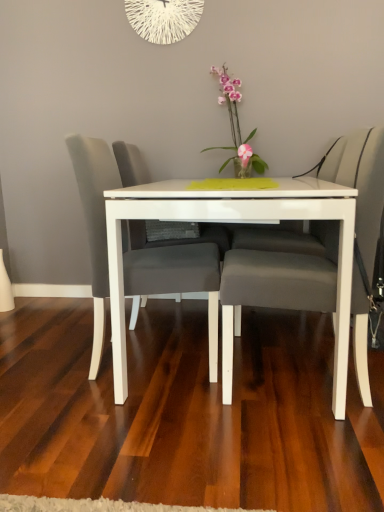
I want to click on matte gray chair at center, the first chair positioned from the left, so click(x=176, y=278).

The height and width of the screenshot is (512, 384). I want to click on matte gray swivel chair at center, so click(178, 239).

Describe the element at coordinates (236, 126) in the screenshot. I see `pink glossy orchid at center` at that location.

Identify the location of pink glossy orchid at center. (236, 126).

This screenshot has height=512, width=384. Describe the element at coordinates (234, 222) in the screenshot. I see `white glossy table at center` at that location.

Find the location of a particular element. This screenshot has height=512, width=384. matte gray chair at center, the first chair positioned from the left is located at coordinates (176, 278).

Does matte gray cushioned chair at center, the 1th chair from the right, have a larger size compared to white glossy table at center?

No.

Considering the relative positions of matte gray cushioned chair at center, the 1th chair from the right, and white glossy table at center in the image provided, is matte gray cushioned chair at center, the 1th chair from the right, to the left or to the right of white glossy table at center?

matte gray cushioned chair at center, the 1th chair from the right, is to the right of white glossy table at center.

Is point (339, 147) less distant than point (343, 400)?

No, (339, 147) is further to viewer.

Who is bigger, matte gray swivel chair at center or white string clock at upper center?

matte gray swivel chair at center.

Locate an element on the screen. oval that appears above the matte gray swivel chair at center (from the image's perspective) is located at coordinates (163, 18).

Which object is closer to the camera taking this photo, matte gray swivel chair at center or white string clock at upper center?

matte gray swivel chair at center is in front.

In the scene shown: Is white glossy table at center in front of matte gray swivel chair at center?

Yes.

At what (x,y) coordinates should I click in order to perform the action: click on swivel chair on the left of white glossy table at center. Please return your answer as a coordinate pair (x, y). Looking at the image, I should click on (178, 239).

Is white glossy table at center looking in the opposite direction of matte gray swivel chair at center?

white glossy table at center is not turned away from matte gray swivel chair at center.

Is matte gray chair at center, the first chair positioned from the left, located outside pink glossy orchid at center?

Yes, matte gray chair at center, the first chair positioned from the left, is not within pink glossy orchid at center.

Does matte gray chair at center, arranged as the 2th chair when viewed from the right, come behind pink glossy orchid at center?

No, matte gray chair at center, arranged as the 2th chair when viewed from the right, is in front of pink glossy orchid at center.

From the image's perspective, is matte gray chair at center, the first chair positioned from the left, positioned above or below pink glossy orchid at center?

matte gray chair at center, the first chair positioned from the left, is below pink glossy orchid at center.

Based on the photo, does white string clock at upper center have a lesser width compared to matte gray chair at center, the first chair positioned from the left?

Correct, the width of white string clock at upper center is less than that of matte gray chair at center, the first chair positioned from the left.

Can you confirm if white string clock at upper center is positioned to the right of matte gray chair at center, arranged as the 2th chair when viewed from the right?

Correct, you'll find white string clock at upper center to the right of matte gray chair at center, arranged as the 2th chair when viewed from the right.

Considering the relative sizes of pink glossy orchid at center and white string clock at upper center in the image provided, is pink glossy orchid at center thinner than white string clock at upper center?

Incorrect, the width of pink glossy orchid at center is not less than that of white string clock at upper center.

Who is taller, pink glossy orchid at center or white string clock at upper center?

pink glossy orchid at center.

Is pink glossy orchid at center positioned beyond the bounds of white string clock at upper center?

Indeed, pink glossy orchid at center is completely outside white string clock at upper center.

Considering the sizes of pink glossy orchid at center and white string clock at upper center in the image, is pink glossy orchid at center bigger or smaller than white string clock at upper center?

→ Considering their sizes, pink glossy orchid at center takes up more space than white string clock at upper center.

Does white string clock at upper center have a greater width compared to matte gray swivel chair at center?

No, white string clock at upper center is not wider than matte gray swivel chair at center.

What's the angular difference between white string clock at upper center and matte gray swivel chair at center's facing directions?

The angle between the facing direction of white string clock at upper center and the facing direction of matte gray swivel chair at center is 90 degrees.

Based on the photo, from the image's perspective, which is below, white string clock at upper center or matte gray swivel chair at center?

matte gray swivel chair at center.

The image size is (384, 512). What are the coordinates of `chair that is the 1st object above the white glossy table at center (from a real-world perspective)` in the screenshot? It's located at (276, 278).

You are a GUI agent. You are given a task and a screenshot of the screen. Output one action in this format:
    pyautogui.click(x=<x>, y=<y>)
    Task: Click on the swivel chair located on the right of white string clock at upper center
    This screenshot has height=512, width=384.
    Given the screenshot: What is the action you would take?
    pyautogui.click(x=178, y=239)

Which object lies nearer to the anchor point matte gray cushioned chair at center, the 1th chair from the right, white glossy table at center or matte gray chair at center, arranged as the 2th chair when viewed from the right?

white glossy table at center lies closer to matte gray cushioned chair at center, the 1th chair from the right, than the other object.

Which object lies further to the anchor point pink glossy orchid at center, white string clock at upper center or matte gray cushioned chair at center, which is counted as the 2th chair, starting from the left?

Based on the image, matte gray cushioned chair at center, which is counted as the 2th chair, starting from the left, appears to be further to pink glossy orchid at center.

From the picture: Considering their positions, is matte gray swivel chair at center positioned further to white string clock at upper center than pink glossy orchid at center?

Based on the image, matte gray swivel chair at center appears to be further to white string clock at upper center.

Looking at the image, which one is located closer to matte gray swivel chair at center, matte gray chair at center, arranged as the 2th chair when viewed from the right, or pink glossy orchid at center?

matte gray chair at center, arranged as the 2th chair when viewed from the right, is positioned closer to the anchor matte gray swivel chair at center.

From the image, which object appears to be farther from white string clock at upper center, matte gray chair at center, arranged as the 2th chair when viewed from the right, or white glossy table at center?

white glossy table at center is positioned further to the anchor white string clock at upper center.

Estimate the real-world distances between objects in this image. Which object is closer to white glossy table at center, white string clock at upper center or pink glossy orchid at center?

The object closer to white glossy table at center is pink glossy orchid at center.

Which object lies further to the anchor point matte gray cushioned chair at center, the 1th chair from the right, white string clock at upper center or white glossy table at center?

Based on the image, white string clock at upper center appears to be further to matte gray cushioned chair at center, the 1th chair from the right.

Which object lies further to the anchor point matte gray chair at center, arranged as the 2th chair when viewed from the right, matte gray cushioned chair at center, which is counted as the 2th chair, starting from the left, or matte gray swivel chair at center?

matte gray cushioned chair at center, which is counted as the 2th chair, starting from the left.

This screenshot has height=512, width=384. What are the coordinates of `swivel chair between matte gray cushioned chair at center, which is counted as the 2th chair, starting from the left, and pink glossy orchid at center, along the z-axis` in the screenshot? It's located at (178, 239).

The image size is (384, 512). Find the location of `chair between white glossy table at center and pink glossy orchid at center along the z-axis`. chair between white glossy table at center and pink glossy orchid at center along the z-axis is located at coordinates (176, 278).

Where is `table between matte gray cushioned chair at center, which is counted as the 2th chair, starting from the left, and pink glossy orchid at center, along the z-axis`? The image size is (384, 512). table between matte gray cushioned chair at center, which is counted as the 2th chair, starting from the left, and pink glossy orchid at center, along the z-axis is located at coordinates (234, 222).

Locate an element on the screen. The width and height of the screenshot is (384, 512). floral arrangement between white string clock at upper center and matte gray swivel chair at center in the vertical direction is located at coordinates tap(236, 126).